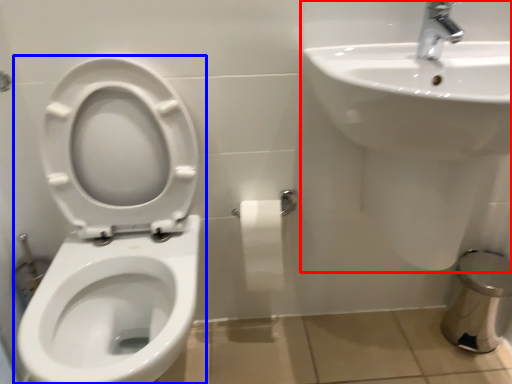
Question: Which object appears closest to the camera in this image, sink (highlighted by a red box) or toilet (highlighted by a blue box)?

Choices:
 (A) sink
 (B) toilet

Answer: (B)